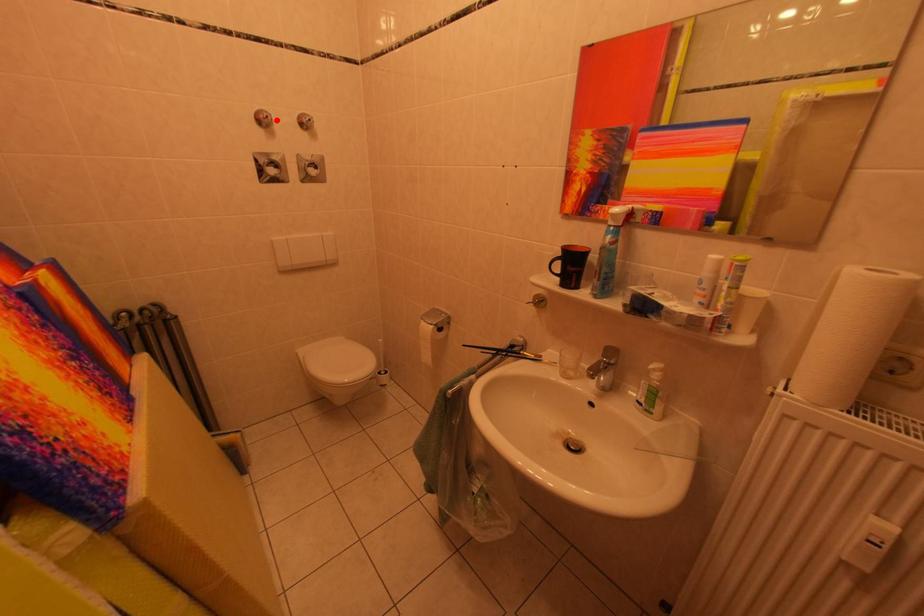
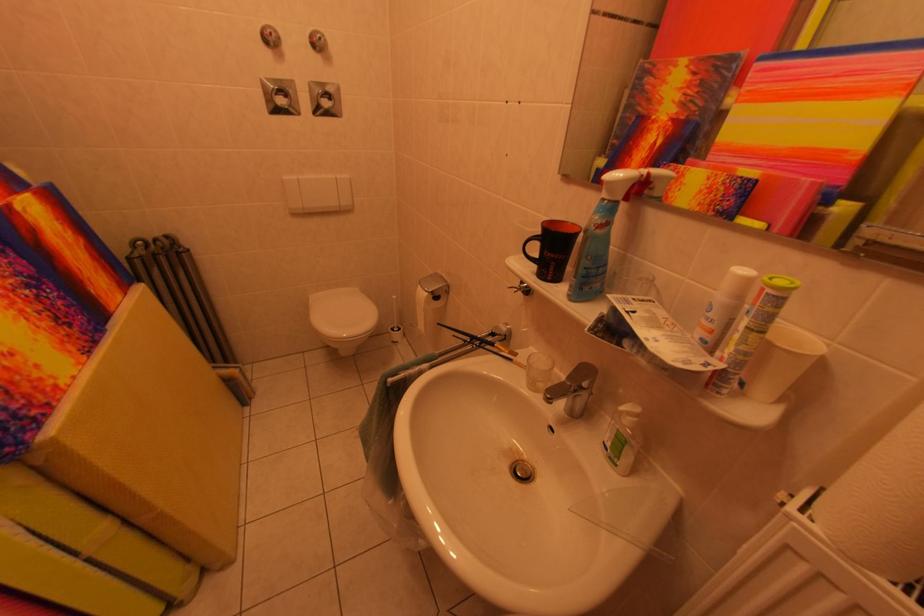
Find the pixel in the second image that matches the highlighted location in the first image.

(278, 39)